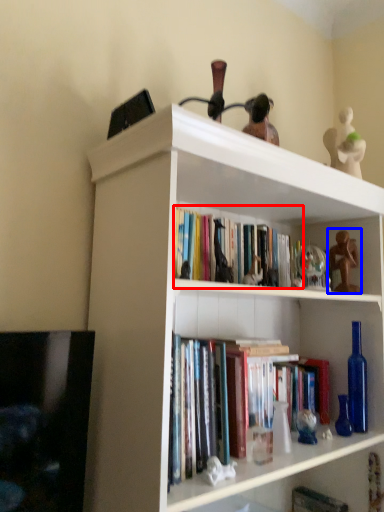
Question: Which object is closer to the camera taking this photo, book (highlighted by a red box) or toy (highlighted by a blue box)?

Choices:
 (A) book
 (B) toy

Answer: (A)